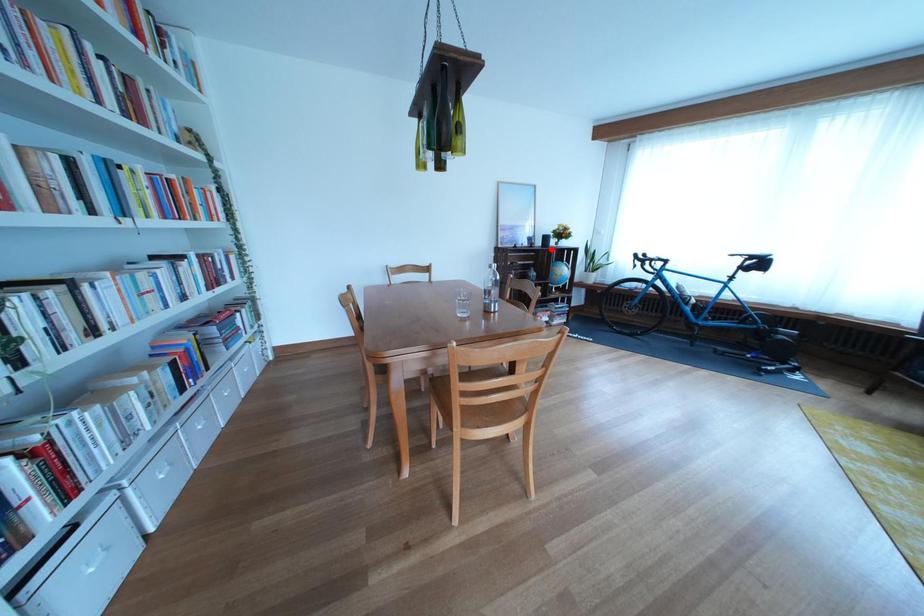
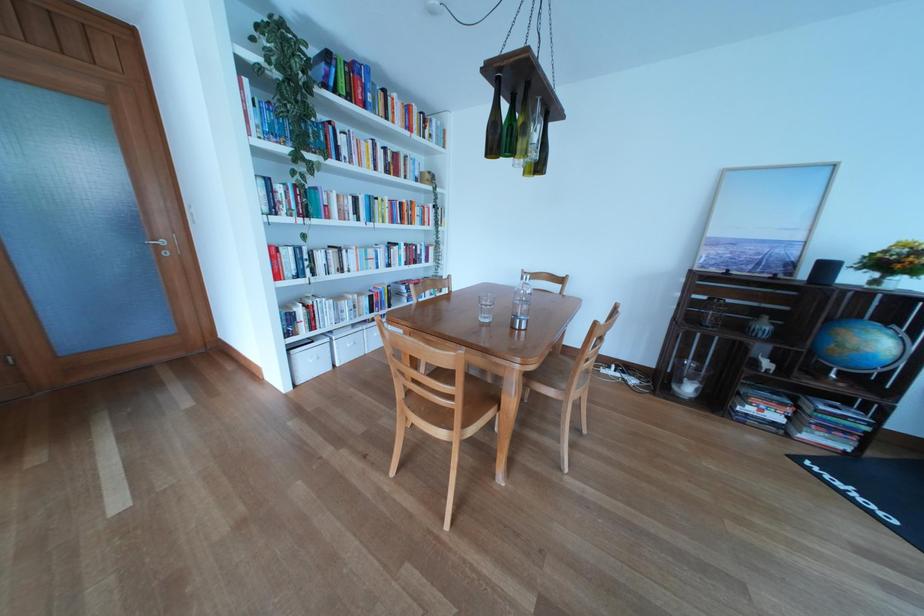
Question: A red point is marked in image1. In image2, is the corresponding 3D point closer to the camera or farther? Reply with the corresponding letter.

Choices:
 (A) The corresponding 3D point is closer.
 (B) The corresponding 3D point is farther.

Answer: (B)